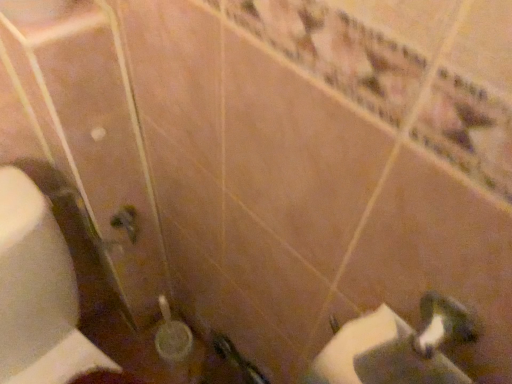
Question: From a real-world perspective, is white matte toilet paper at lower left physically located above or below white glossy sink at lower right?

Choices:
 (A) below
 (B) above

Answer: (A)

Question: Does point (14, 334) appear closer or farther from the camera than point (433, 360)?

Choices:
 (A) farther
 (B) closer

Answer: (A)

Question: Relative to white glossy sink at lower right, is white matte toilet paper at lower left in front or behind?

Choices:
 (A) front
 (B) behind

Answer: (B)

Question: Based on their sizes in the image, would you say white glossy sink at lower right is bigger or smaller than white matte toilet paper at lower left?

Choices:
 (A) big
 (B) small

Answer: (B)

Question: From a real-world perspective, is white glossy sink at lower right positioned above or below white matte toilet paper at lower left?

Choices:
 (A) above
 (B) below

Answer: (A)

Question: Is white glossy sink at lower right taller or shorter than white matte toilet paper at lower left?

Choices:
 (A) tall
 (B) short

Answer: (B)

Question: Considering the positions of white glossy sink at lower right and white matte toilet paper at lower left in the image, is white glossy sink at lower right wider or thinner than white matte toilet paper at lower left?

Choices:
 (A) thin
 (B) wide

Answer: (A)